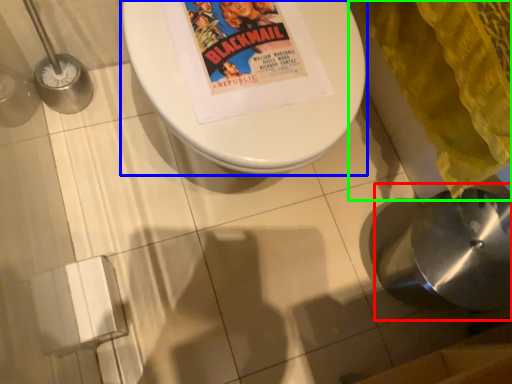
Question: Based on their relative distances, which object is farther from sink (highlighted by a red box)? Choose from toilet (highlighted by a blue box) and blanket (highlighted by a green box).

Choices:
 (A) toilet
 (B) blanket

Answer: (A)